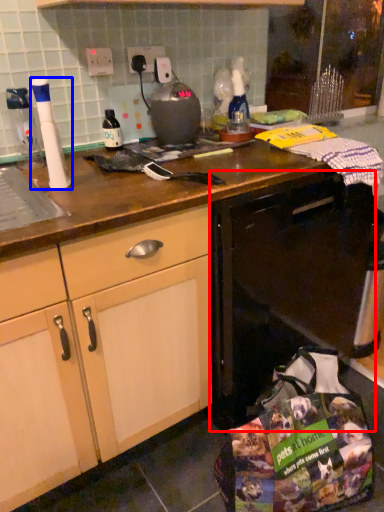
Question: Which of the following is the closest to the observer, dish washer (highlighted by a red box) or kitchen appliance (highlighted by a blue box)?

Choices:
 (A) dish washer
 (B) kitchen appliance

Answer: (B)